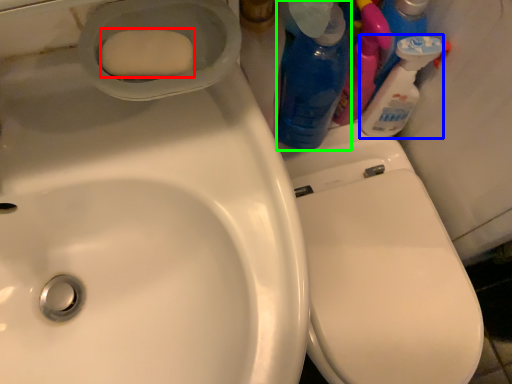
Question: Considering the real-world distances, which object is closest to soap (highlighted by a red box)? cleaning product (highlighted by a blue box) or cleaning product (highlighted by a green box).

Choices:
 (A) cleaning product
 (B) cleaning product

Answer: (B)